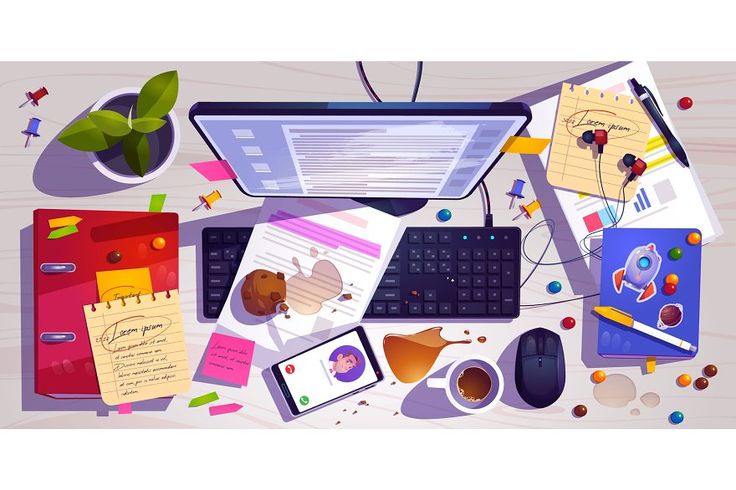
Image resolution: width=736 pixels, height=490 pixels. Identify the location of thumbtacks. (32, 122), (31, 92), (208, 197), (520, 212), (519, 193).